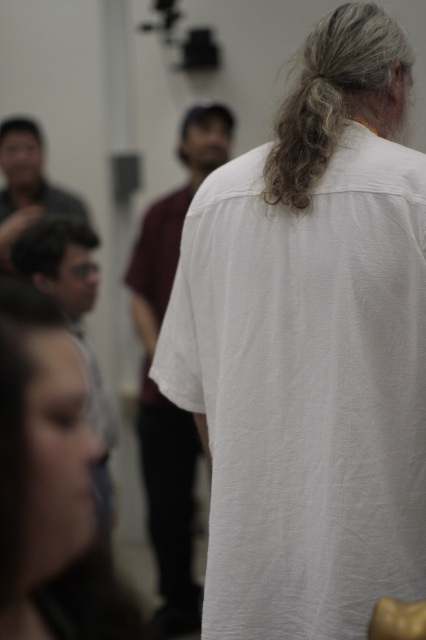
Is white cotton shirt at center to the right of matte gray shirt at lower left from the viewer's perspective?

Indeed, white cotton shirt at center is positioned on the right side of matte gray shirt at lower left.

You are a GUI agent. You are given a task and a screenshot of the screen. Output one action in this format:
    pyautogui.click(x=<x>, y=<y>)
    Task: Click on the white cotton shirt at center
    The height and width of the screenshot is (640, 426).
    Given the screenshot: What is the action you would take?
    pyautogui.click(x=155, y=385)

The image size is (426, 640). In order to click on white cotton shirt at center in this screenshot , I will do `click(155, 385)`.

Based on the photo, which is above, curly blonde hair at upper center or matte gray shirt at lower left?

curly blonde hair at upper center is above.

Is curly blonde hair at upper center to the right of matte gray shirt at lower left from the viewer's perspective?

Yes, curly blonde hair at upper center is to the right of matte gray shirt at lower left.

Who is more forward, [357,10] or [100,417]?

Point [357,10] is in front.

This screenshot has height=640, width=426. In order to click on curly blonde hair at upper center in this screenshot , I will do `click(328, 93)`.

Can you confirm if white cotton t-shirt at center is positioned to the right of white cotton shirt at center?

Indeed, white cotton t-shirt at center is positioned on the right side of white cotton shirt at center.

Locate an element on the screen. The height and width of the screenshot is (640, 426). white cotton t-shirt at center is located at coordinates (307, 388).

The height and width of the screenshot is (640, 426). Identify the location of white cotton t-shirt at center. (307, 388).